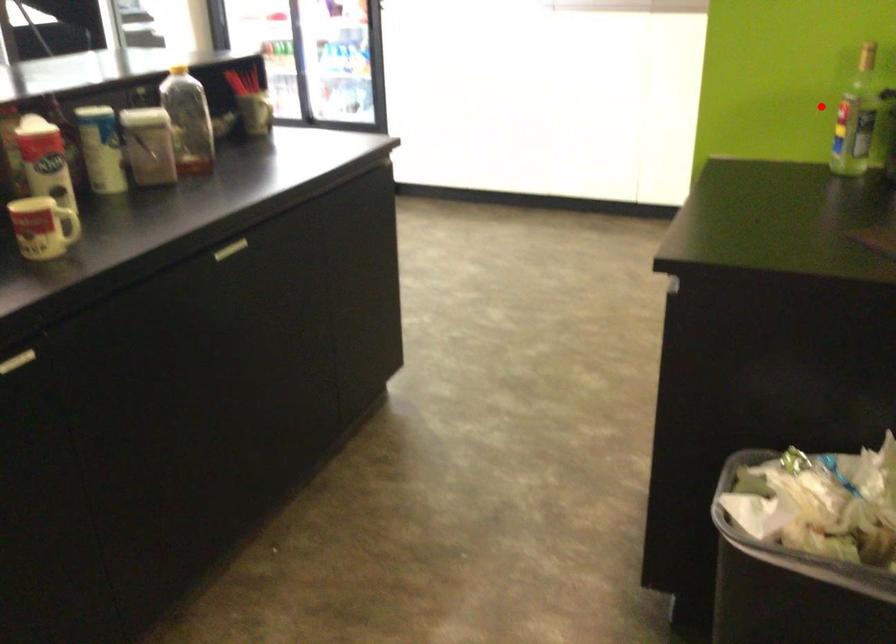
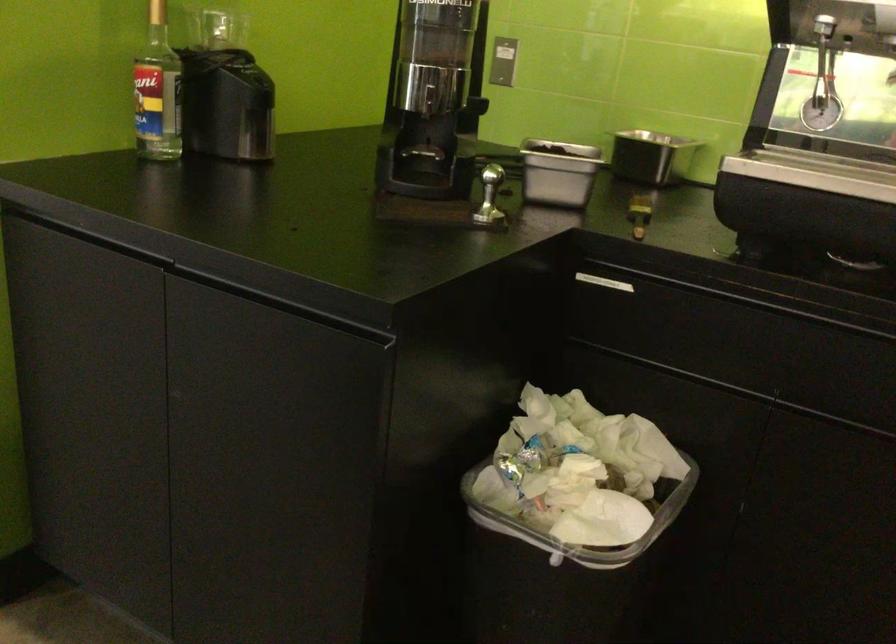
In the second image, find the point that corresponds to the highlighted location in the first image.

(158, 91)